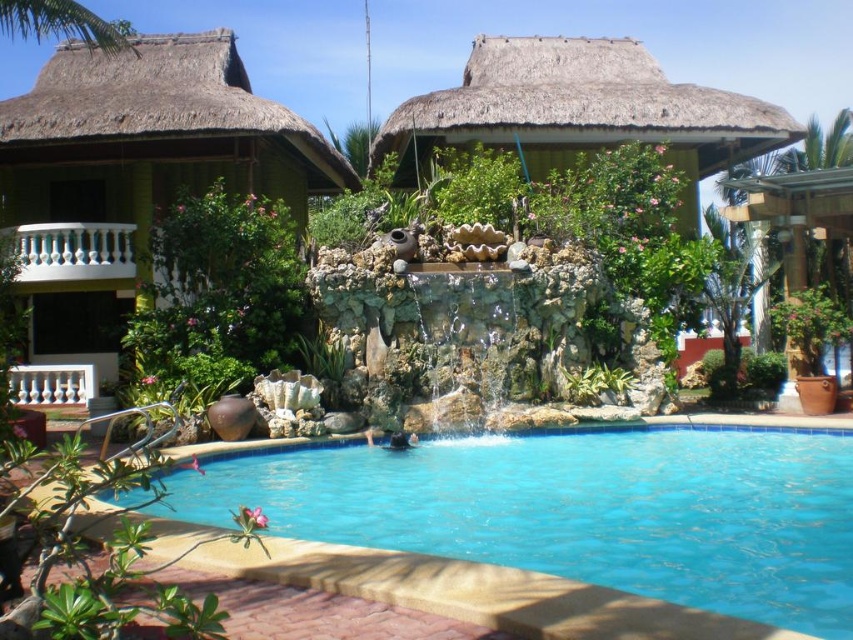
Question: Which point appears closest to the camera in this image?

Choices:
 (A) (222, 138)
 (B) (718, 609)

Answer: (B)

Question: Does blue tile swimming pool at center appear on the right side of natural thatched roof hut at center?

Choices:
 (A) no
 (B) yes

Answer: (A)

Question: Considering the relative positions of green thatched roof hut at left and natural thatched roof hut at center in the image provided, where is green thatched roof hut at left located with respect to natural thatched roof hut at center?

Choices:
 (A) right
 (B) left

Answer: (B)

Question: Can you confirm if blue tile swimming pool at center is bigger than green thatched roof hut at left?

Choices:
 (A) no
 (B) yes

Answer: (A)

Question: Which point appears closest to the camera in this image?

Choices:
 (A) (426, 483)
 (B) (119, 236)

Answer: (A)

Question: Which object is positioned farthest from the blue tile swimming pool at center?

Choices:
 (A) natural thatched roof hut at center
 (B) green thatched roof hut at left

Answer: (B)